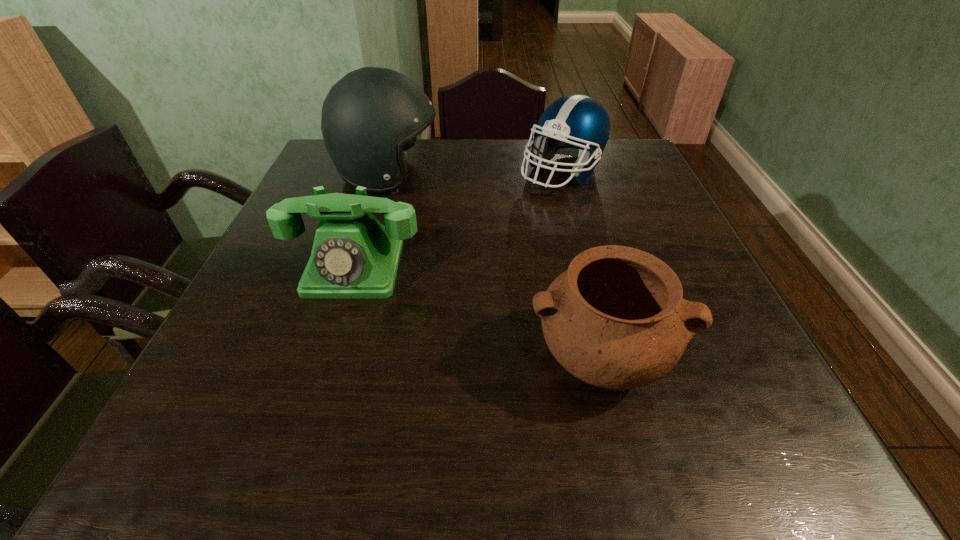
Image resolution: width=960 pixels, height=540 pixels. I want to click on the left football helmet, so click(371, 117).

The width and height of the screenshot is (960, 540). What are the coordinates of `the taller football helmet` in the screenshot? It's located at (371, 117).

At what (x,y) coordinates should I click in order to perform the action: click on the right football helmet. Please return your answer as a coordinate pair (x, y). Looking at the image, I should click on (576, 125).

At what (x,y) coordinates should I click in order to perform the action: click on pottery. Please return your answer as a coordinate pair (x, y). This screenshot has height=540, width=960. Looking at the image, I should click on (616, 318).

At what (x,y) coordinates should I click in order to perform the action: click on telephone. Please return your answer as a coordinate pair (x, y). Looking at the image, I should click on (353, 256).

Identify the location of vacant space positioned at the face opening of the taller football helmet. (549, 176).

Where is `vacant area situated at the front of the shorter football helmet with the faceguard`? vacant area situated at the front of the shorter football helmet with the faceguard is located at coordinates (577, 228).

Identify the location of free space located 0.210m on the left of the pottery. (404, 359).

You are a GUI agent. You are given a task and a screenshot of the screen. Output one action in this format:
    pyautogui.click(x=<x>, y=<y>)
    Task: Click on the free space located on the dial of the second nearest object
    This screenshot has height=540, width=960.
    Given the screenshot: What is the action you would take?
    click(x=326, y=357)

You are a GUI agent. You are given a task and a screenshot of the screen. Output one action in this format:
    pyautogui.click(x=<x>, y=<y>)
    Task: Click on the football helmet situated at the left edge
    The height and width of the screenshot is (540, 960).
    Given the screenshot: What is the action you would take?
    pyautogui.click(x=371, y=117)